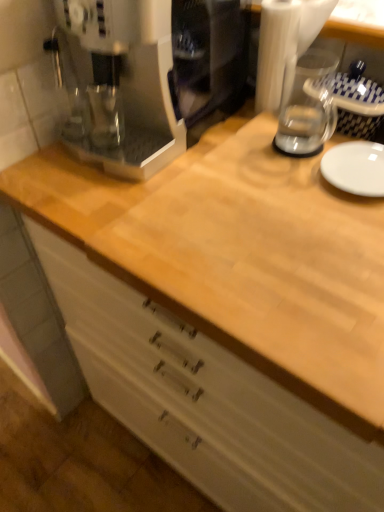
Locate an element on the screen. free space to the left of white glossy plate at right is located at coordinates (266, 184).